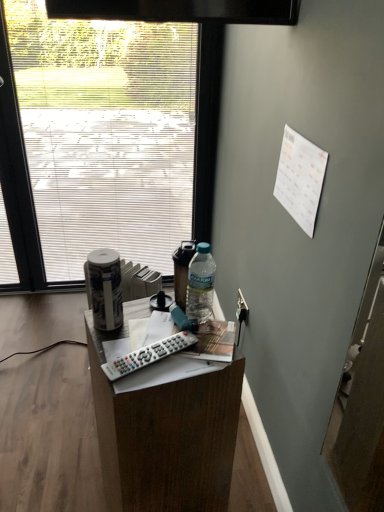
Question: Is frosted glass window at upper left at the right side of white glossy canister at left?

Choices:
 (A) yes
 (B) no

Answer: (B)

Question: Can you confirm if frosted glass window at upper left is wider than white glossy canister at left?

Choices:
 (A) yes
 (B) no

Answer: (A)

Question: Does frosted glass window at upper left have a larger size compared to white glossy canister at left?

Choices:
 (A) no
 (B) yes

Answer: (B)

Question: Is the position of frosted glass window at upper left less distant than that of white glossy canister at left?

Choices:
 (A) yes
 (B) no

Answer: (B)

Question: Considering the relative sizes of frosted glass window at upper left and white glossy canister at left in the image provided, is frosted glass window at upper left thinner than white glossy canister at left?

Choices:
 (A) no
 (B) yes

Answer: (A)

Question: Is the position of frosted glass window at upper left more distant than that of white glossy canister at left?

Choices:
 (A) yes
 (B) no

Answer: (A)

Question: Is white plastic remote control at center not close to white glossy canister at left?

Choices:
 (A) yes
 (B) no

Answer: (B)

Question: Is white glossy canister at left completely or partially inside white plastic remote control at center?

Choices:
 (A) no
 (B) yes

Answer: (A)

Question: Considering the relative sizes of white plastic remote control at center and white glossy canister at left in the image provided, is white plastic remote control at center shorter than white glossy canister at left?

Choices:
 (A) yes
 (B) no

Answer: (A)

Question: Can you confirm if white plastic remote control at center is wider than white glossy canister at left?

Choices:
 (A) yes
 (B) no

Answer: (A)

Question: Is white plastic remote control at center at the left side of white glossy canister at left?

Choices:
 (A) yes
 (B) no

Answer: (B)

Question: From the image's perspective, would you say white plastic remote control at center is shown under white glossy canister at left?

Choices:
 (A) yes
 (B) no

Answer: (A)

Question: Can we say white glossy canister at left lies outside frosted glass window at upper left?

Choices:
 (A) no
 (B) yes

Answer: (B)